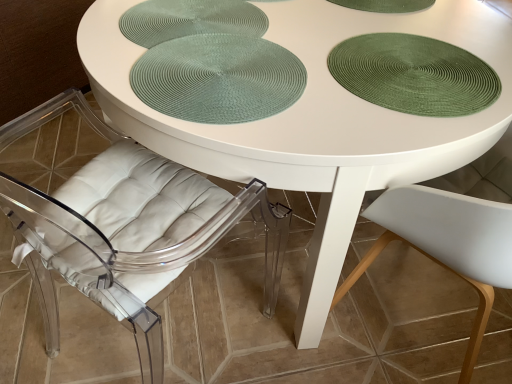
Where is `green textured placemat at upper right, which is the 1th glass plate in right-to-left order`? The height and width of the screenshot is (384, 512). green textured placemat at upper right, which is the 1th glass plate in right-to-left order is located at coordinates [414, 74].

Describe the element at coordinates (190, 20) in the screenshot. I see `green woven placemat at upper center, which ranks as the first glass plate in left-to-right order` at that location.

Where is `green woven placemat at center`? green woven placemat at center is located at coordinates (218, 78).

This screenshot has height=384, width=512. In order to click on transparent acrylic chair at lower left in this screenshot , I will do `click(120, 220)`.

Is green textured placemat at upper right, which is the 1th glass plate in right-to-left order, directly adjacent to green woven placemat at upper center, which ranks as the first glass plate in left-to-right order?

No, green textured placemat at upper right, which is the 1th glass plate in right-to-left order, is not making contact with green woven placemat at upper center, which ranks as the first glass plate in left-to-right order.

From a real-world perspective, is green textured placemat at upper right, positioned as the 2th glass plate in left-to-right order, on green woven placemat at upper center, which ranks as the first glass plate in left-to-right order?

Correct, in the physical world, green textured placemat at upper right, positioned as the 2th glass plate in left-to-right order, is higher than green woven placemat at upper center, which ranks as the first glass plate in left-to-right order.

Is green textured placemat at upper right, positioned as the 2th glass plate in left-to-right order, further to camera compared to green woven placemat at upper center, which ranks as the first glass plate in left-to-right order?

No.

Who is smaller, green textured placemat at upper right, positioned as the 2th glass plate in left-to-right order, or green woven placemat at upper center, which ranks as the 2th glass plate in right-to-left order?

green textured placemat at upper right, positioned as the 2th glass plate in left-to-right order, is smaller.

Where is `chair lying below the green woven placemat at upper center, which ranks as the first glass plate in left-to-right order (from the image's perspective)`? This screenshot has width=512, height=384. chair lying below the green woven placemat at upper center, which ranks as the first glass plate in left-to-right order (from the image's perspective) is located at coordinates (120, 220).

Is green woven placemat at upper center, which ranks as the 2th glass plate in right-to-left order, spatially inside transparent acrylic chair at lower left, or outside of it?

green woven placemat at upper center, which ranks as the 2th glass plate in right-to-left order, is spatially situated outside transparent acrylic chair at lower left.

Considering the relative sizes of green woven placemat at upper center, which ranks as the first glass plate in left-to-right order, and transparent acrylic chair at lower left in the image provided, is green woven placemat at upper center, which ranks as the first glass plate in left-to-right order, thinner than transparent acrylic chair at lower left?

Correct, the width of green woven placemat at upper center, which ranks as the first glass plate in left-to-right order, is less than that of transparent acrylic chair at lower left.

Which is more distant, (174, 36) or (174, 240)?

The point (174, 36) is behind.

Based on their positions, is transparent acrylic chair at lower left located to the left or right of green textured placemat at upper right, which is the 1th glass plate in right-to-left order?

transparent acrylic chair at lower left is positioned on green textured placemat at upper right, which is the 1th glass plate in right-to-left order,'s left side.

From the image's perspective, which glass plate is the 1st one above the transparent acrylic chair at lower left? Please provide its 2D coordinates.

[(414, 74)]

Would you consider transparent acrylic chair at lower left to be distant from green textured placemat at upper right, positioned as the 2th glass plate in left-to-right order?

Indeed, transparent acrylic chair at lower left is not near green textured placemat at upper right, positioned as the 2th glass plate in left-to-right order.

How many degrees apart are the facing directions of transparent acrylic chair at lower left and green textured placemat at upper right, positioned as the 2th glass plate in left-to-right order?

The facing directions of transparent acrylic chair at lower left and green textured placemat at upper right, positioned as the 2th glass plate in left-to-right order, are 134 degrees apart.

Who is shorter, green woven placemat at center or green woven placemat at upper center, which ranks as the first glass plate in left-to-right order?

Standing shorter between the two is green woven placemat at upper center, which ranks as the first glass plate in left-to-right order.

Image resolution: width=512 pixels, height=384 pixels. In order to click on the 2nd glass plate behind the green woven placemat at center in this screenshot , I will do `click(190, 20)`.

Between green woven placemat at center and green woven placemat at upper center, which ranks as the first glass plate in left-to-right order, which one is positioned behind?

Positioned behind is green woven placemat at upper center, which ranks as the first glass plate in left-to-right order.

From the image's perspective, would you say green woven placemat at center is positioned over green woven placemat at upper center, which ranks as the 2th glass plate in right-to-left order?

No, from the image's perspective, green woven placemat at center is not above green woven placemat at upper center, which ranks as the 2th glass plate in right-to-left order.

How much distance is there between green textured placemat at upper right, positioned as the 2th glass plate in left-to-right order, and green woven placemat at center?

green textured placemat at upper right, positioned as the 2th glass plate in left-to-right order, is 10.24 inches from green woven placemat at center.

Between green textured placemat at upper right, which is the 1th glass plate in right-to-left order, and green woven placemat at center, which one has smaller width?

With smaller width is green woven placemat at center.

From their relative heights in the image, would you say green textured placemat at upper right, which is the 1th glass plate in right-to-left order, is taller or shorter than green woven placemat at center?

Clearly, green textured placemat at upper right, which is the 1th glass plate in right-to-left order, is shorter compared to green woven placemat at center.

Considering the sizes of green textured placemat at upper right, positioned as the 2th glass plate in left-to-right order, and green woven placemat at center in the image, is green textured placemat at upper right, positioned as the 2th glass plate in left-to-right order, bigger or smaller than green woven placemat at center?

Clearly, green textured placemat at upper right, positioned as the 2th glass plate in left-to-right order, is smaller in size than green woven placemat at center.

From the image's perspective, would you say green woven placemat at center is positioned over green textured placemat at upper right, which is the 1th glass plate in right-to-left order?

No, from the image's perspective, green woven placemat at center is not over green textured placemat at upper right, which is the 1th glass plate in right-to-left order.

Considering the positions of objects green woven placemat at center and green textured placemat at upper right, positioned as the 2th glass plate in left-to-right order, in the image provided, who is more to the right, green woven placemat at center or green textured placemat at upper right, positioned as the 2th glass plate in left-to-right order,?

green textured placemat at upper right, positioned as the 2th glass plate in left-to-right order, is more to the right.

Is point (275, 47) positioned after point (434, 96)?

Yes, point (275, 47) is farther from viewer.

Does transparent acrylic chair at lower left appear on the right side of green woven placemat at upper center, which ranks as the first glass plate in left-to-right order?

No, transparent acrylic chair at lower left is not to the right of green woven placemat at upper center, which ranks as the first glass plate in left-to-right order.

Considering the sizes of objects transparent acrylic chair at lower left and green woven placemat at upper center, which ranks as the first glass plate in left-to-right order, in the image provided, who is shorter, transparent acrylic chair at lower left or green woven placemat at upper center, which ranks as the first glass plate in left-to-right order,?

green woven placemat at upper center, which ranks as the first glass plate in left-to-right order.

This screenshot has height=384, width=512. What are the coordinates of `chair that appears on the left of green woven placemat at upper center, which ranks as the 2th glass plate in right-to-left order` in the screenshot? It's located at (120, 220).

Where is `glass plate on the left of green textured placemat at upper right, which is the 1th glass plate in right-to-left order`? This screenshot has height=384, width=512. glass plate on the left of green textured placemat at upper right, which is the 1th glass plate in right-to-left order is located at coordinates (190, 20).

Identify the location of chair located underneath the green woven placemat at upper center, which ranks as the first glass plate in left-to-right order (from a real-world perspective). Image resolution: width=512 pixels, height=384 pixels. 120,220.

Which object lies further to the anchor point green woven placemat at center, transparent acrylic chair at lower left or green woven placemat at upper center, which ranks as the first glass plate in left-to-right order?

transparent acrylic chair at lower left is positioned further to the anchor green woven placemat at center.

Estimate the real-world distances between objects in this image. Which object is closer to green woven placemat at center, green textured placemat at upper right, positioned as the 2th glass plate in left-to-right order, or green woven placemat at upper center, which ranks as the first glass plate in left-to-right order?

green woven placemat at upper center, which ranks as the first glass plate in left-to-right order.

Estimate the real-world distances between objects in this image. Which object is closer to green woven placemat at center, green textured placemat at upper right, which is the 1th glass plate in right-to-left order, or transparent acrylic chair at lower left?

green textured placemat at upper right, which is the 1th glass plate in right-to-left order, lies closer to green woven placemat at center than the other object.

Which object lies nearer to the anchor point green woven placemat at upper center, which ranks as the 2th glass plate in right-to-left order, green textured placemat at upper right, which is the 1th glass plate in right-to-left order, or transparent acrylic chair at lower left?

green textured placemat at upper right, which is the 1th glass plate in right-to-left order, is positioned closer to the anchor green woven placemat at upper center, which ranks as the 2th glass plate in right-to-left order.

Looking at the image, which one is located further to green textured placemat at upper right, which is the 1th glass plate in right-to-left order, green woven placemat at upper center, which ranks as the 2th glass plate in right-to-left order, or green woven placemat at center?

green woven placemat at upper center, which ranks as the 2th glass plate in right-to-left order, is positioned further to the anchor green textured placemat at upper right, which is the 1th glass plate in right-to-left order.

Which object lies further to the anchor point green woven placemat at center, green woven placemat at upper center, which ranks as the first glass plate in left-to-right order, or transparent acrylic chair at lower left?

The object further to green woven placemat at center is transparent acrylic chair at lower left.

When comparing their distances from green textured placemat at upper right, which is the 1th glass plate in right-to-left order, does transparent acrylic chair at lower left or green woven placemat at upper center, which ranks as the 2th glass plate in right-to-left order, seem further?

Based on the image, transparent acrylic chair at lower left appears to be further to green textured placemat at upper right, which is the 1th glass plate in right-to-left order.

Looking at the image, which one is located closer to transparent acrylic chair at lower left, green woven placemat at center or green textured placemat at upper right, positioned as the 2th glass plate in left-to-right order?

Among the two, green woven placemat at center is located nearer to transparent acrylic chair at lower left.

The image size is (512, 384). I want to click on poker table located between green woven placemat at upper center, which ranks as the 2th glass plate in right-to-left order, and green textured placemat at upper right, which is the 1th glass plate in right-to-left order, in the left-right direction, so click(x=218, y=78).

What are the coordinates of `glass plate between transparent acrylic chair at lower left and green textured placemat at upper right, positioned as the 2th glass plate in left-to-right order, in the horizontal direction` in the screenshot? It's located at (190, 20).

The width and height of the screenshot is (512, 384). Find the location of `poker table between transparent acrylic chair at lower left and green woven placemat at upper center, which ranks as the first glass plate in left-to-right order, from front to back`. poker table between transparent acrylic chair at lower left and green woven placemat at upper center, which ranks as the first glass plate in left-to-right order, from front to back is located at coordinates (218, 78).

Locate an element on the screen. The height and width of the screenshot is (384, 512). poker table located between transparent acrylic chair at lower left and green textured placemat at upper right, positioned as the 2th glass plate in left-to-right order, in the left-right direction is located at coordinates (218, 78).